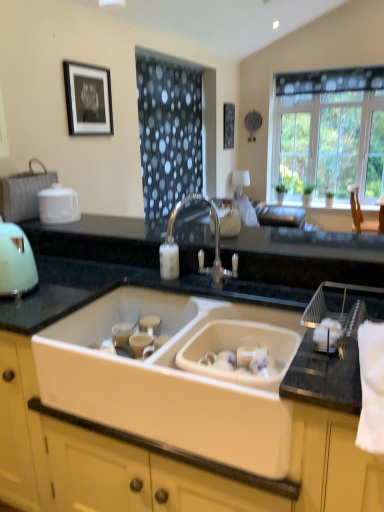
Question: Can you confirm if satin nickel faucet at center is thinner than matte green kettle at left?

Choices:
 (A) no
 (B) yes

Answer: (A)

Question: Does satin nickel faucet at center have a smaller size compared to matte green kettle at left?

Choices:
 (A) yes
 (B) no

Answer: (B)

Question: Are satin nickel faucet at center and matte green kettle at left making contact?

Choices:
 (A) no
 (B) yes

Answer: (A)

Question: Considering the relative sizes of satin nickel faucet at center and matte green kettle at left in the image provided, is satin nickel faucet at center taller than matte green kettle at left?

Choices:
 (A) yes
 (B) no

Answer: (A)

Question: From the image's perspective, would you say satin nickel faucet at center is positioned over matte green kettle at left?

Choices:
 (A) yes
 (B) no

Answer: (B)

Question: In terms of height, does white ceramic sink at center look taller or shorter compared to clear glass window at upper right?

Choices:
 (A) short
 (B) tall

Answer: (A)

Question: Would you say white ceramic sink at center is to the left or to the right of clear glass window at upper right in the picture?

Choices:
 (A) right
 (B) left

Answer: (B)

Question: Based on their sizes in the image, would you say white ceramic sink at center is bigger or smaller than clear glass window at upper right?

Choices:
 (A) small
 (B) big

Answer: (A)

Question: Looking at their shapes, would you say white ceramic sink at center is wider or thinner than clear glass window at upper right?

Choices:
 (A) thin
 (B) wide

Answer: (B)

Question: Do you think satin nickel faucet at center is within black matte picture frame at upper center, the 2th picture frame in the bottom-to-top sequence, or outside of it?

Choices:
 (A) inside
 (B) outside

Answer: (B)

Question: Would you say satin nickel faucet at center is to the left or to the right of black matte picture frame at upper center, arranged as the 2th picture frame when viewed from the front, in the picture?

Choices:
 (A) left
 (B) right

Answer: (A)

Question: In terms of height, does satin nickel faucet at center look taller or shorter compared to black matte picture frame at upper center, arranged as the first picture frame when viewed from the back?

Choices:
 (A) tall
 (B) short

Answer: (B)

Question: Is point (201, 271) positioned closer to the camera than point (228, 116)?

Choices:
 (A) closer
 (B) farther

Answer: (A)

Question: From their relative heights in the image, would you say matte green kettle at left is taller or shorter than clear glass window at upper right?

Choices:
 (A) tall
 (B) short

Answer: (B)

Question: Is matte green kettle at left inside or outside of clear glass window at upper right?

Choices:
 (A) inside
 (B) outside

Answer: (B)